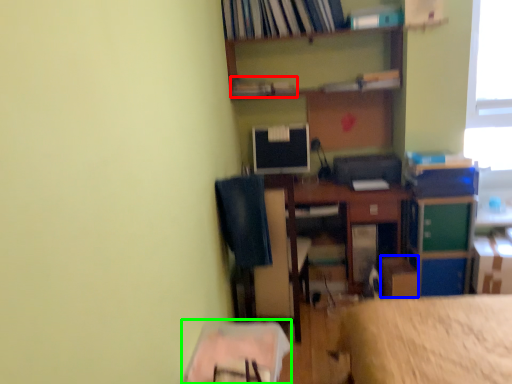
Question: Estimate the real-world distances between objects in this image. Which object is farther from book (highlighted by a red box), cardboard box (highlighted by a blue box) or table (highlighted by a green box)?

Choices:
 (A) cardboard box
 (B) table

Answer: (B)